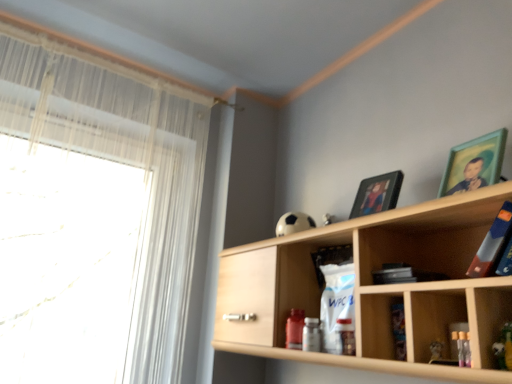
Question: Is green matte picture frame at upper right, the 1th picture frame from the front, directly adjacent to white sheer curtain at left?

Choices:
 (A) no
 (B) yes

Answer: (A)

Question: Is green matte picture frame at upper right, marked as the 2th picture frame in a left-to-right arrangement, turned away from white sheer curtain at left?

Choices:
 (A) yes
 (B) no

Answer: (B)

Question: Is green matte picture frame at upper right, arranged as the second picture frame when viewed from the back, smaller than white sheer curtain at left?

Choices:
 (A) no
 (B) yes

Answer: (B)

Question: Could white sheer curtain at left be considered to be inside green matte picture frame at upper right, marked as the 2th picture frame in a left-to-right arrangement?

Choices:
 (A) yes
 (B) no

Answer: (B)

Question: From the image's perspective, would you say green matte picture frame at upper right, arranged as the first picture frame when viewed from the right, is positioned over white sheer curtain at left?

Choices:
 (A) no
 (B) yes

Answer: (B)

Question: Looking at the image, does white sheer curtain at left seem bigger or smaller compared to green matte picture frame at upper right, arranged as the second picture frame when viewed from the back?

Choices:
 (A) small
 (B) big

Answer: (B)

Question: Which is correct: white sheer curtain at left is inside green matte picture frame at upper right, the 1th picture frame from the front, or outside of it?

Choices:
 (A) inside
 (B) outside

Answer: (B)

Question: Is white sheer curtain at left to the left or to the right of green matte picture frame at upper right, the 1th picture frame from the front, in the image?

Choices:
 (A) right
 (B) left

Answer: (B)

Question: Considering their positions, is white sheer curtain at left located in front of or behind green matte picture frame at upper right, arranged as the first picture frame when viewed from the right?

Choices:
 (A) behind
 (B) front

Answer: (A)

Question: Do you think white sheer curtain at left is within wooden shelf at upper right, or outside of it?

Choices:
 (A) inside
 (B) outside

Answer: (B)

Question: In terms of size, does white sheer curtain at left appear bigger or smaller than wooden shelf at upper right?

Choices:
 (A) small
 (B) big

Answer: (B)

Question: From a real-world perspective, is white sheer curtain at left positioned above or below wooden shelf at upper right?

Choices:
 (A) above
 (B) below

Answer: (A)

Question: From the image's perspective, is white sheer curtain at left located above or below wooden shelf at upper right?

Choices:
 (A) above
 (B) below

Answer: (A)

Question: In terms of width, does hardcover book at upper right look wider or thinner when compared to green matte picture frame at upper right, the 1th picture frame from the front?

Choices:
 (A) thin
 (B) wide

Answer: (B)

Question: Considering their positions, is hardcover book at upper right located in front of or behind green matte picture frame at upper right, arranged as the second picture frame when viewed from the back?

Choices:
 (A) front
 (B) behind

Answer: (A)